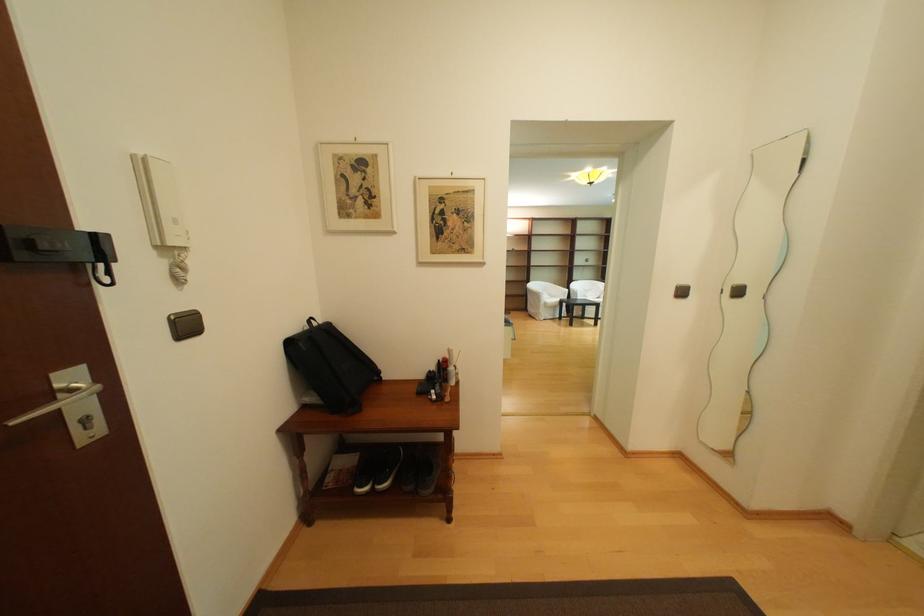
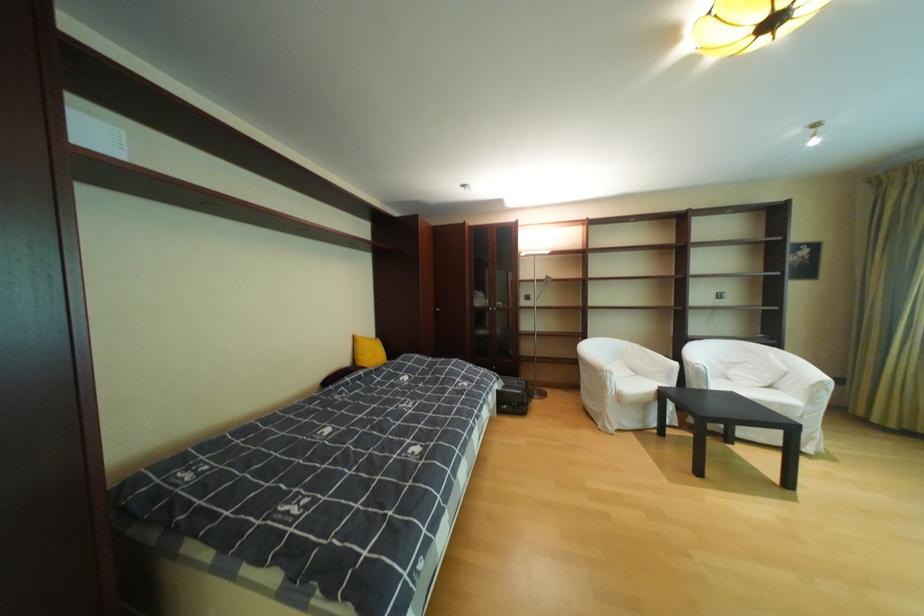
Locate, in the second image, the point that corresponds to (x=602, y=300) in the first image.

(763, 394)